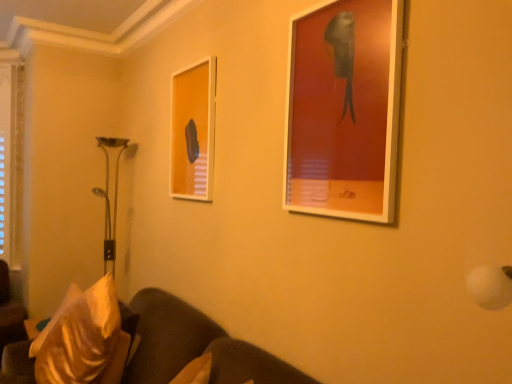
Question: Is matte glass picture frame at center, marked as the 1th picture frame in a left-to-right arrangement, facing away from velvet gold pillow at lower left?

Choices:
 (A) yes
 (B) no

Answer: (B)

Question: Is matte glass picture frame at center, the second picture frame in the right-to-left sequence, further to the viewer compared to velvet gold pillow at lower left?

Choices:
 (A) no
 (B) yes

Answer: (B)

Question: Is there a large distance between matte glass picture frame at center, which is the 1th picture frame from back to front, and velvet gold pillow at lower left?

Choices:
 (A) no
 (B) yes

Answer: (A)

Question: Could velvet gold pillow at lower left be considered to be inside matte glass picture frame at center, marked as the 1th picture frame in a left-to-right arrangement?

Choices:
 (A) yes
 (B) no

Answer: (B)

Question: From a real-world perspective, is matte glass picture frame at center, the second picture frame in the right-to-left sequence, beneath velvet gold pillow at lower left?

Choices:
 (A) yes
 (B) no

Answer: (B)

Question: Considering the positions of point (339, 137) and point (88, 304), is point (339, 137) closer or farther from the camera than point (88, 304)?

Choices:
 (A) farther
 (B) closer

Answer: (B)

Question: Considering the relative positions of matte white picture frame at upper right, arranged as the first picture frame when viewed from the right, and velvet gold pillow at lower left in the image provided, is matte white picture frame at upper right, arranged as the first picture frame when viewed from the right, to the left or to the right of velvet gold pillow at lower left?

Choices:
 (A) right
 (B) left

Answer: (A)

Question: Is matte white picture frame at upper right, the 2th picture frame in the back-to-front sequence, spatially inside velvet gold pillow at lower left, or outside of it?

Choices:
 (A) outside
 (B) inside

Answer: (A)

Question: Considering their positions, is matte white picture frame at upper right, the 2th picture frame in the back-to-front sequence, located in front of or behind velvet gold pillow at lower left?

Choices:
 (A) front
 (B) behind

Answer: (A)

Question: Is suede-like brown couch at lower left in front of or behind matte white picture frame at upper right, marked as the first picture frame in a front-to-back arrangement, in the image?

Choices:
 (A) front
 (B) behind

Answer: (A)

Question: Considering the positions of suede-like brown couch at lower left and matte white picture frame at upper right, arranged as the first picture frame when viewed from the right, in the image, is suede-like brown couch at lower left wider or thinner than matte white picture frame at upper right, arranged as the first picture frame when viewed from the right,?

Choices:
 (A) thin
 (B) wide

Answer: (B)

Question: Is suede-like brown couch at lower left inside the boundaries of matte white picture frame at upper right, marked as the first picture frame in a front-to-back arrangement, or outside?

Choices:
 (A) outside
 (B) inside

Answer: (A)

Question: Based on their sizes in the image, would you say suede-like brown couch at lower left is bigger or smaller than matte white picture frame at upper right, placed as the second picture frame when sorted from left to right?

Choices:
 (A) big
 (B) small

Answer: (A)

Question: Based on their positions, is suede-like brown couch at lower left located to the left or right of velvet gold pillow at lower left?

Choices:
 (A) right
 (B) left

Answer: (A)

Question: From the image's perspective, relative to velvet gold pillow at lower left, is suede-like brown couch at lower left above or below?

Choices:
 (A) below
 (B) above

Answer: (A)